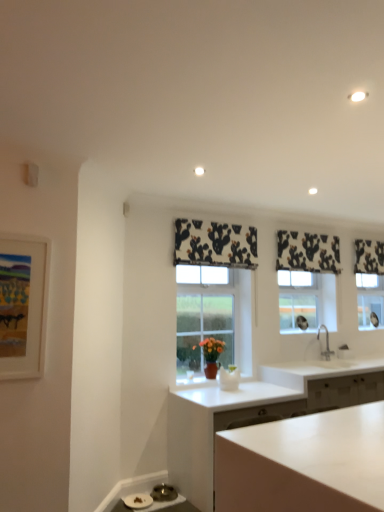
Measure the distance between point (169,405) and camera.

Point (169,405) and camera are 3.70 meters apart.

The image size is (384, 512). Describe the element at coordinates (369, 257) in the screenshot. I see `black and white fabric at upper right, placed as the first curtain when sorted from back to front` at that location.

The height and width of the screenshot is (512, 384). What are the coordinates of `white glossy countertop at lower right` in the screenshot? It's located at (317, 370).

Describe the element at coordinates (215, 244) in the screenshot. I see `black printed fabric at upper center, the 1th curtain from the front` at that location.

Locate an element on the screen. This screenshot has height=512, width=384. black printed fabric at upper center, the second curtain in the right-to-left sequence is located at coordinates (307, 252).

Based on the photo, how many degrees apart are the facing directions of black and white fabric at upper right, which ranks as the 1th curtain in right-to-left order, and white glossy countertop at lower right?

1.97 degrees.

Considering the relative sizes of black and white fabric at upper right, the third curtain viewed from the left, and white glossy countertop at lower right in the image provided, is black and white fabric at upper right, the third curtain viewed from the left, smaller than white glossy countertop at lower right?

Indeed, black and white fabric at upper right, the third curtain viewed from the left, has a smaller size compared to white glossy countertop at lower right.

Considering the relative positions of black and white fabric at upper right, placed as the first curtain when sorted from back to front, and white glossy countertop at lower right in the image provided, is black and white fabric at upper right, placed as the first curtain when sorted from back to front, to the left of white glossy countertop at lower right from the viewer's perspective?

In fact, black and white fabric at upper right, placed as the first curtain when sorted from back to front, is to the right of white glossy countertop at lower right.

In the scene shown: Is black and white fabric at upper right, the third curtain viewed from the front, beside white glossy countertop at lower right?

black and white fabric at upper right, the third curtain viewed from the front, and white glossy countertop at lower right are clearly separated.

Considering the relative sizes of black printed fabric at upper center, the 2th curtain from the left, and silver metallic faucet at right in the image provided, is black printed fabric at upper center, the 2th curtain from the left, thinner than silver metallic faucet at right?

Correct, the width of black printed fabric at upper center, the 2th curtain from the left, is less than that of silver metallic faucet at right.

Is black printed fabric at upper center, the second curtain in the right-to-left sequence, far from silver metallic faucet at right?

No.

Image resolution: width=384 pixels, height=512 pixels. I want to click on the 3rd curtain above the silver metallic faucet at right (from a real-world perspective), so click(x=307, y=252).

Who is smaller, black and white fabric at upper right, placed as the first curtain when sorted from back to front, or silver metallic faucet at right?

Smaller between the two is black and white fabric at upper right, placed as the first curtain when sorted from back to front.

From the image's perspective, which object appears higher, black and white fabric at upper right, placed as the first curtain when sorted from back to front, or silver metallic faucet at right?

black and white fabric at upper right, placed as the first curtain when sorted from back to front, is shown above in the image.

Which object is further away from the camera taking this photo, black and white fabric at upper right, the third curtain viewed from the left, or silver metallic faucet at right?

Positioned behind is black and white fabric at upper right, the third curtain viewed from the left.

Based on their positions, is black and white fabric at upper right, the third curtain viewed from the front, located to the left or right of silver metallic faucet at right?

From the image, it's evident that black and white fabric at upper right, the third curtain viewed from the front, is to the right of silver metallic faucet at right.

Image resolution: width=384 pixels, height=512 pixels. Find the location of `the 1st curtain in front when counting from the black and white fabric at upper right, which ranks as the 1th curtain in right-to-left order`. the 1st curtain in front when counting from the black and white fabric at upper right, which ranks as the 1th curtain in right-to-left order is located at coordinates (307, 252).

Considering the sizes of objects black printed fabric at upper center, the second curtain positioned from the back, and black and white fabric at upper right, the third curtain viewed from the left, in the image provided, who is smaller, black printed fabric at upper center, the second curtain positioned from the back, or black and white fabric at upper right, the third curtain viewed from the left,?

With smaller size is black and white fabric at upper right, the third curtain viewed from the left.

Could you tell me if black printed fabric at upper center, the second curtain in the right-to-left sequence, is facing black and white fabric at upper right, placed as the first curtain when sorted from back to front?

No, black printed fabric at upper center, the second curtain in the right-to-left sequence, does not turn towards black and white fabric at upper right, placed as the first curtain when sorted from back to front.

Based on the photo, measure the distance between silver metallic faucet at right and black printed fabric at upper center, which is the 3th curtain from back to front.

silver metallic faucet at right is 1.60 meters from black printed fabric at upper center, which is the 3th curtain from back to front.

Would you say silver metallic faucet at right is inside or outside black printed fabric at upper center, which is the 1th curtain from left to right?

The correct answer is: outside.

Does silver metallic faucet at right come in front of black printed fabric at upper center, arranged as the third curtain when viewed from the right?

No, it is behind black printed fabric at upper center, arranged as the third curtain when viewed from the right.

Is silver metallic faucet at right smaller than black printed fabric at upper center, arranged as the third curtain when viewed from the right?

Correct, silver metallic faucet at right occupies less space than black printed fabric at upper center, arranged as the third curtain when viewed from the right.

Which of these two, matte white picture frame at left or white matte cabinet at center, is wider?

white matte cabinet at center is wider.

Considering the sizes of objects matte white picture frame at left and white matte cabinet at center in the image provided, who is taller, matte white picture frame at left or white matte cabinet at center?

matte white picture frame at left.

Which is closer to the camera, (35, 358) or (224, 391)?

Point (35, 358) is closer to the camera than point (224, 391).

Does matte white picture frame at left appear on the right side of white matte cabinet at center?

Incorrect, matte white picture frame at left is not on the right side of white matte cabinet at center.

From the image's perspective, between black printed fabric at upper center, which is the 1th curtain from left to right, and matte white picture frame at left, who is located below?

matte white picture frame at left appears lower in the image.

Does black printed fabric at upper center, the 1th curtain from the front, have a lesser height compared to matte white picture frame at left?

Indeed, black printed fabric at upper center, the 1th curtain from the front, has a lesser height compared to matte white picture frame at left.

Identify the location of the 3rd curtain above the matte white picture frame at left (from the image's perspective). 215,244.

Considering the positions of objects black printed fabric at upper center, which is the 1th curtain from left to right, and matte white picture frame at left in the image provided, who is more to the left, black printed fabric at upper center, which is the 1th curtain from left to right, or matte white picture frame at left?

matte white picture frame at left.

You are a GUI agent. You are given a task and a screenshot of the screen. Output one action in this format:
    pyautogui.click(x=<x>, y=<y>)
    Task: Click on the countertop located below the black and white fabric at upper right, the third curtain viewed from the left (from the image's perspective)
    Image resolution: width=384 pixels, height=512 pixels.
    Given the screenshot: What is the action you would take?
    pyautogui.click(x=317, y=370)

Identify the location of tap that appears below the black printed fabric at upper center, the second curtain positioned from the front (from a real-world perspective). (326, 343).

When comparing their distances from black and white fabric at upper right, the third curtain viewed from the left, does white glossy countertop at lower right or white matte cabinet at center seem further?

white matte cabinet at center.

Which object lies nearer to the anchor point white glossy countertop at lower right, matte white picture frame at left or white matte cabinet at center?

Among the two, white matte cabinet at center is located nearer to white glossy countertop at lower right.

When comparing their distances from silver metallic faucet at right, does white matte cabinet at center or black and white fabric at upper right, which ranks as the 1th curtain in right-to-left order, seem closer?

black and white fabric at upper right, which ranks as the 1th curtain in right-to-left order, lies closer to silver metallic faucet at right than the other object.

Looking at the image, which one is located further to black and white fabric at upper right, which ranks as the 1th curtain in right-to-left order, black printed fabric at upper center, the second curtain positioned from the front, or black printed fabric at upper center, the 1th curtain from the front?

black printed fabric at upper center, the 1th curtain from the front, is further to black and white fabric at upper right, which ranks as the 1th curtain in right-to-left order.

Looking at the image, which one is located further to black printed fabric at upper center, the second curtain in the right-to-left sequence, white matte cabinet at center or white glossy countertop at lower right?

white matte cabinet at center.

Consider the image. From the image, which object appears to be farther from silver metallic faucet at right, white glossy countertop at lower right or black and white fabric at upper right, the third curtain viewed from the front?

black and white fabric at upper right, the third curtain viewed from the front, is positioned further to the anchor silver metallic faucet at right.

Which object lies nearer to the anchor point silver metallic faucet at right, white glossy countertop at lower right or black printed fabric at upper center, the 1th curtain from the front?

The object closer to silver metallic faucet at right is white glossy countertop at lower right.

Looking at the image, which one is located closer to black and white fabric at upper right, placed as the first curtain when sorted from back to front, white glossy countertop at lower right or silver metallic faucet at right?

silver metallic faucet at right is closer to black and white fabric at upper right, placed as the first curtain when sorted from back to front.

Image resolution: width=384 pixels, height=512 pixels. What are the coordinates of `cabinetry located between black printed fabric at upper center, which is the 3th curtain from back to front, and black and white fabric at upper right, the third curtain viewed from the front, in the left-right direction` in the screenshot? It's located at (216, 428).

Identify the location of curtain located between black printed fabric at upper center, which is the 3th curtain from back to front, and silver metallic faucet at right in the left-right direction. The width and height of the screenshot is (384, 512). (307, 252).

Locate an element on the screen. tap between black and white fabric at upper right, the third curtain viewed from the left, and white glossy countertop at lower right from top to bottom is located at coordinates tap(326, 343).

This screenshot has width=384, height=512. What are the coordinates of `curtain between black printed fabric at upper center, the second curtain positioned from the back, and silver metallic faucet at right, in the vertical direction` in the screenshot? It's located at (369, 257).